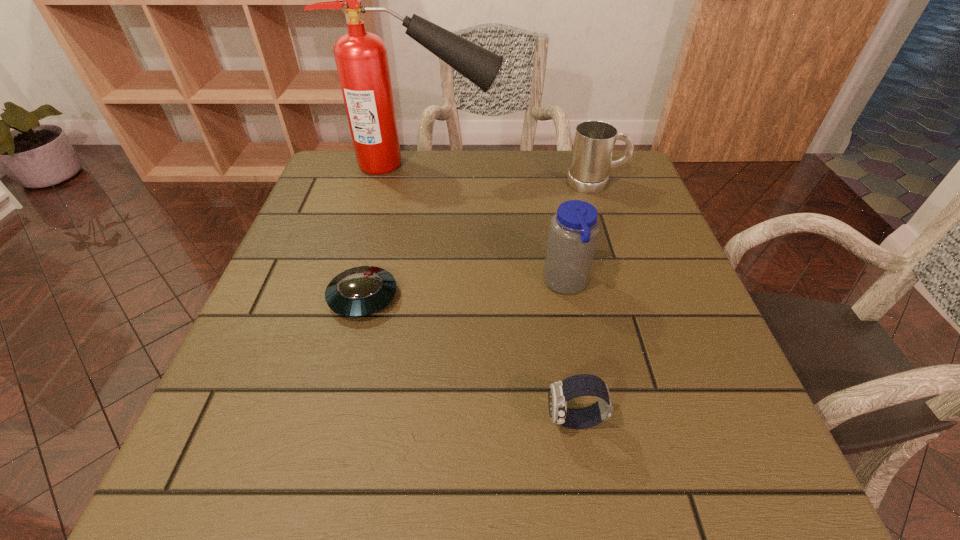
Where is `fire extinguisher`? fire extinguisher is located at coordinates (361, 58).

Image resolution: width=960 pixels, height=540 pixels. I want to click on the second tallest object, so click(573, 233).

At what (x,y) coordinates should I click in order to perform the action: click on the third shortest object. Please return your answer as a coordinate pair (x, y). Looking at the image, I should click on pyautogui.click(x=594, y=141).

Locate an element on the screen. Image resolution: width=960 pixels, height=540 pixels. mug is located at coordinates (594, 141).

Find the location of `the fourth tallest object`. the fourth tallest object is located at coordinates (561, 392).

What are the coordinates of `the nearest object` in the screenshot? It's located at (561, 392).

Locate an element on the screen. the shortest object is located at coordinates (361, 291).

You are a GUI agent. You are given a task and a screenshot of the screen. Output one action in this format:
    pyautogui.click(x=<x>, y=<y>)
    Task: Click on the vacant space situated at the nozzle of the fire extinguisher
    The image size is (960, 540).
    Given the screenshot: What is the action you would take?
    pyautogui.click(x=597, y=164)

At what (x,y) coordinates should I click in order to perform the action: click on vacant space located with a carrying loop on the side of the second tallest object. Please return your answer as a coordinate pair (x, y). This screenshot has height=540, width=960. Looking at the image, I should click on (444, 284).

At what (x,y) coordinates should I click in order to perform the action: click on vacant space located with a carrying loop on the side of the second tallest object. Please return your answer as a coordinate pair (x, y). Looking at the image, I should click on (385, 284).